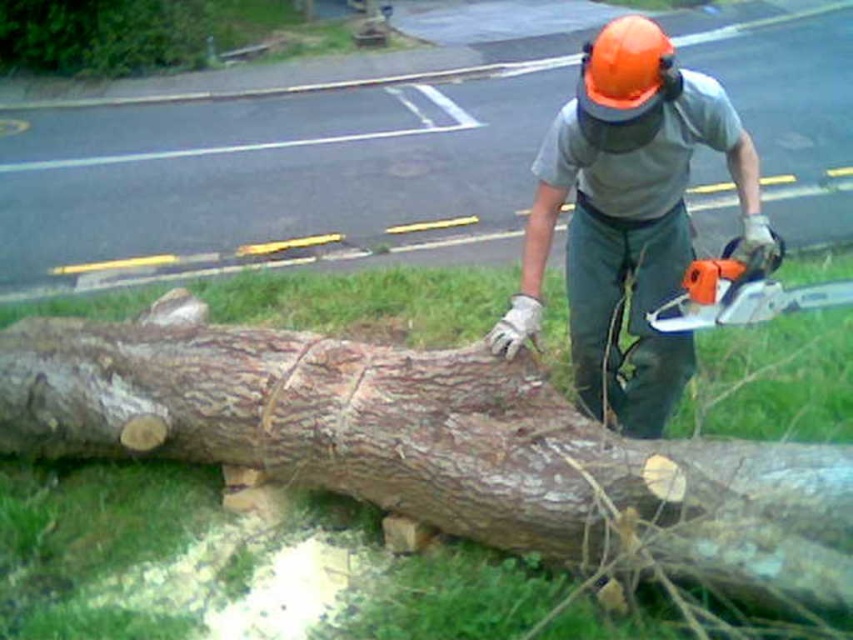
You are a safety inspector checking the scene. You notice the orange hard hat at upper center and the orange plastic chainsaw at center. According to safety regulations, which object should be positioned higher to ensure proper visibility?

The orange hard hat at upper center should be positioned higher than the orange plastic chainsaw at center to ensure proper visibility as per safety regulations.

You are standing at the road edge and want to walk towards the tree trunk. Which point, point (810, 525) or point (654, 106), would you reach first?

Point (810, 525) is closer to the viewer than point (654, 106), so you would reach point (810, 525) first.